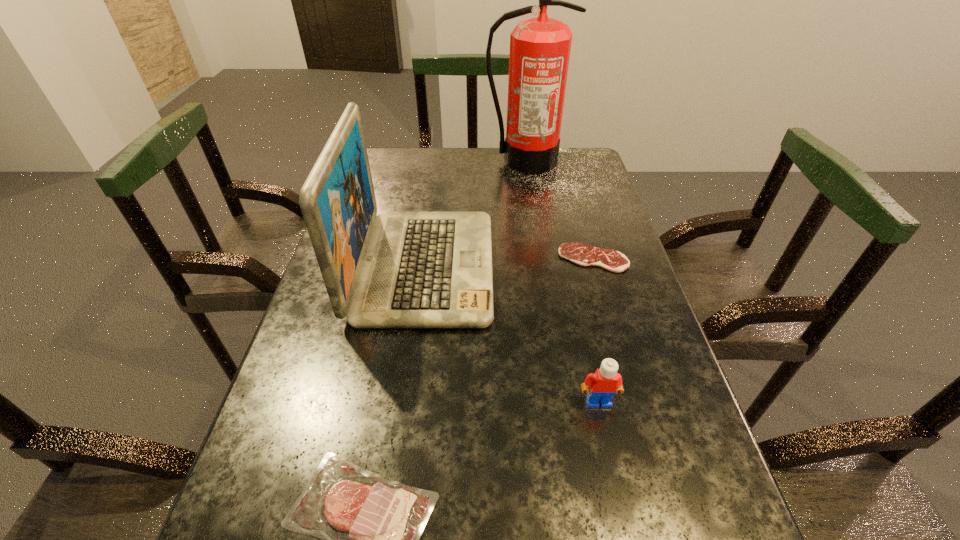
Locate an element on the screen. The height and width of the screenshot is (540, 960). vacant space situated 0.050m on the front of the shorter steak is located at coordinates (602, 288).

Locate an element on the screen. This screenshot has width=960, height=540. object that is at the far edge is located at coordinates (540, 47).

This screenshot has width=960, height=540. In order to click on object situated at the left edge in this screenshot , I will do `click(396, 269)`.

You are a GUI agent. You are given a task and a screenshot of the screen. Output one action in this format:
    pyautogui.click(x=<x>, y=<y>)
    Task: Click on the fire extinguisher situated at the right edge
    The height and width of the screenshot is (540, 960).
    Given the screenshot: What is the action you would take?
    pyautogui.click(x=540, y=47)

What are the coordinates of `Lego that is at the right edge` in the screenshot? It's located at (601, 386).

Where is `steak that is at the right edge`? steak that is at the right edge is located at coordinates (581, 254).

This screenshot has width=960, height=540. In order to click on object that is at the far right corner in this screenshot , I will do `click(540, 47)`.

Image resolution: width=960 pixels, height=540 pixels. I want to click on free point at the far edge, so click(495, 181).

The image size is (960, 540). What are the coordinates of `vacant space at the left edge of the desktop` in the screenshot? It's located at (333, 341).

You are a GUI agent. You are given a task and a screenshot of the screen. Output one action in this format:
    pyautogui.click(x=<x>, y=<y>)
    Task: Click on the free space at the right edge of the desktop
    This screenshot has width=960, height=540.
    Given the screenshot: What is the action you would take?
    pyautogui.click(x=597, y=202)